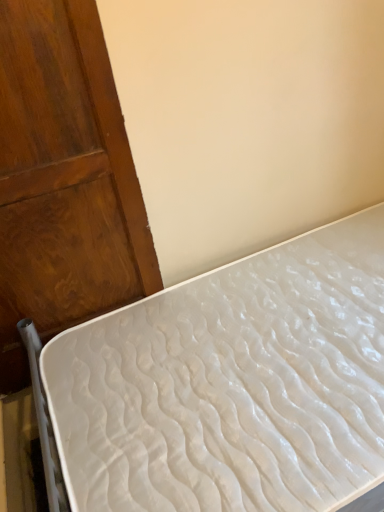
Measure the distance between white textured mattress at lower right and camera.

A distance of 34.60 inches exists between white textured mattress at lower right and camera.

What do you see at coordinates (226, 386) in the screenshot? This screenshot has width=384, height=512. I see `white textured mattress at lower right` at bounding box center [226, 386].

What are the coordinates of `white textured mattress at lower right` in the screenshot? It's located at (226, 386).

Image resolution: width=384 pixels, height=512 pixels. What do you see at coordinates (63, 180) in the screenshot?
I see `wooden door at left` at bounding box center [63, 180].

Find the location of a particular element. The width and height of the screenshot is (384, 512). wooden door at left is located at coordinates (63, 180).

In order to face wooden door at left, should I rotate leftwards or rightwards?

Rotate your view left by about 19.543°.

Identify the location of white textured mattress at lower right. The width and height of the screenshot is (384, 512). (226, 386).

From the picture: Which object is positioned more to the left, white textured mattress at lower right or wooden door at left?

wooden door at left.

Does white textured mattress at lower right come in front of wooden door at left?

Yes, it is.

Which point is more distant from viewer, (214, 503) or (7, 382)?

The point (7, 382) is more distant.

Based on the photo, from the image's perspective, does white textured mattress at lower right appear higher than wooden door at left?

No.

From a real-world perspective, does white textured mattress at lower right stand above wooden door at left?

Incorrect, from a real-world perspective, white textured mattress at lower right is lower than wooden door at left.

Considering the sizes of white textured mattress at lower right and wooden door at left in the image, is white textured mattress at lower right wider or thinner than wooden door at left?

Clearly, white textured mattress at lower right has more width compared to wooden door at left.

In terms of height, does white textured mattress at lower right look taller or shorter compared to wooden door at left?

In the image, white textured mattress at lower right appears to be shorter than wooden door at left.

Is white textured mattress at lower right smaller than wooden door at left?

Incorrect, white textured mattress at lower right is not smaller in size than wooden door at left.

Is white textured mattress at lower right completely or partially outside of wooden door at left?

Yes, white textured mattress at lower right is located beyond the bounds of wooden door at left.

Are white textured mattress at lower right and wooden door at left located far from each other?

white textured mattress at lower right is near wooden door at left, not far away.

Is white textured mattress at lower right turned away from wooden door at left?

No, white textured mattress at lower right is not facing away from wooden door at left.

Locate an element on the screen. This screenshot has width=384, height=512. door that is on the left side of white textured mattress at lower right is located at coordinates (63, 180).

Considering the relative positions of wooden door at left and white textured mattress at lower right in the image provided, is wooden door at left to the left of white textured mattress at lower right from the viewer's perspective?

Indeed, wooden door at left is positioned on the left side of white textured mattress at lower right.

Which object is closer to the camera, wooden door at left or white textured mattress at lower right?

white textured mattress at lower right is closer to the camera.

Considering the points (102, 195) and (88, 334), which point is in front, point (102, 195) or point (88, 334)?

The point (102, 195) is closer.

From the image's perspective, is wooden door at left located beneath white textured mattress at lower right?

No, from the image's perspective, wooden door at left is not beneath white textured mattress at lower right.

From a real-world perspective, who is located lower, wooden door at left or white textured mattress at lower right?

In real-world perspective, white textured mattress at lower right is lower.

In terms of width, does wooden door at left look wider or thinner when compared to white textured mattress at lower right?

wooden door at left is thinner than white textured mattress at lower right.

Does wooden door at left have a lesser height compared to white textured mattress at lower right?

No.

Does wooden door at left have a smaller size compared to white textured mattress at lower right?

Indeed, wooden door at left has a smaller size compared to white textured mattress at lower right.

Would you say white textured mattress at lower right is part of wooden door at left's contents?

No, white textured mattress at lower right is not surrounded by wooden door at left.

Consider the image. Is the surface of wooden door at left in direct contact with white textured mattress at lower right?

No, wooden door at left is not next to white textured mattress at lower right.

Is wooden door at left aimed at white textured mattress at lower right?

No, wooden door at left does not turn towards white textured mattress at lower right.

What's the angular difference between wooden door at left and white textured mattress at lower right's facing directions?

89.2 degrees.

Image resolution: width=384 pixels, height=512 pixels. I want to click on bed in front of the wooden door at left, so click(226, 386).

Find the location of a particular element. This screenshot has width=384, height=512. bed below the wooden door at left (from the image's perspective) is located at coordinates (226, 386).

The height and width of the screenshot is (512, 384). Identify the location of bed on the right of wooden door at left. (226, 386).